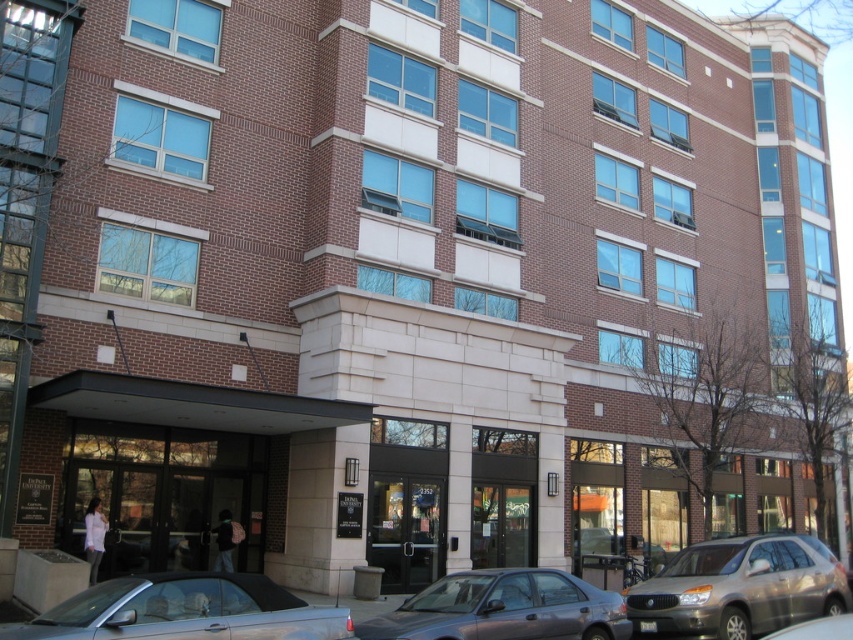
Which is behind, point (744, 602) or point (335, 618)?

The point (744, 602) is behind.

Locate an element on the screen. The height and width of the screenshot is (640, 853). silver metallic suv at lower right is located at coordinates (740, 588).

In order to click on silver metallic suv at lower right in this screenshot , I will do `click(740, 588)`.

Image resolution: width=853 pixels, height=640 pixels. Identify the location of silver metallic suv at lower right. (740, 588).

What do you see at coordinates (740, 588) in the screenshot? The width and height of the screenshot is (853, 640). I see `silver metallic suv at lower right` at bounding box center [740, 588].

In the scene shown: Who is shorter, silver metallic suv at lower right or metallic gray sedan at center?

silver metallic suv at lower right

Does point (672, 582) come farther from viewer compared to point (476, 627)?

Yes, point (672, 582) is farther from viewer.

Image resolution: width=853 pixels, height=640 pixels. I want to click on silver metallic suv at lower right, so click(740, 588).

Image resolution: width=853 pixels, height=640 pixels. Find the location of `silver metallic convertible at lower left`. silver metallic convertible at lower left is located at coordinates (184, 611).

Is point (172, 580) closer to camera compared to point (563, 579)?

Yes, it is.

Does point (289, 593) come closer to viewer compared to point (622, 637)?

No, it is not.

Find the location of a particular element. The width and height of the screenshot is (853, 640). silver metallic convertible at lower left is located at coordinates (184, 611).